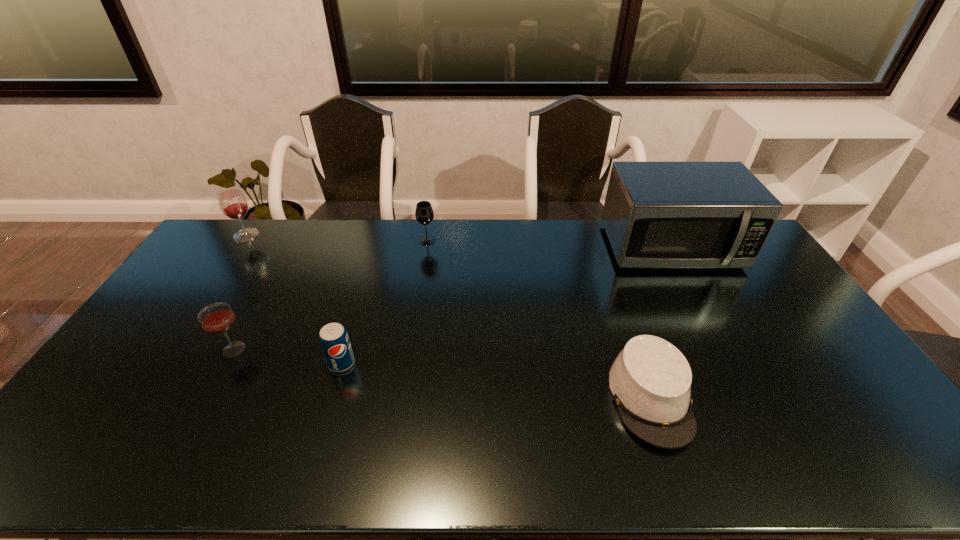
Find the location of a particular element. vacant region between the shortest object and the pop is located at coordinates (496, 381).

Identify the location of free area in between the shortest object and the microwave oven. (660, 322).

Identify the location of object that is the second closest to the pop. (424, 214).

I want to click on object that is the third closest to the leftmost wineglass, so click(334, 340).

In order to click on wineglass that is the second closest one to the leftmost object in this screenshot , I will do `click(424, 214)`.

Locate an element on the screen. wineglass that is the closest to the fourth object from left to right is located at coordinates (233, 204).

Locate an element on the screen. vacant space that satisfies the following two spatial constraints: 1. on the front side of the fourth object from right to left; 2. on the right side of the second object from left to right is located at coordinates (227, 363).